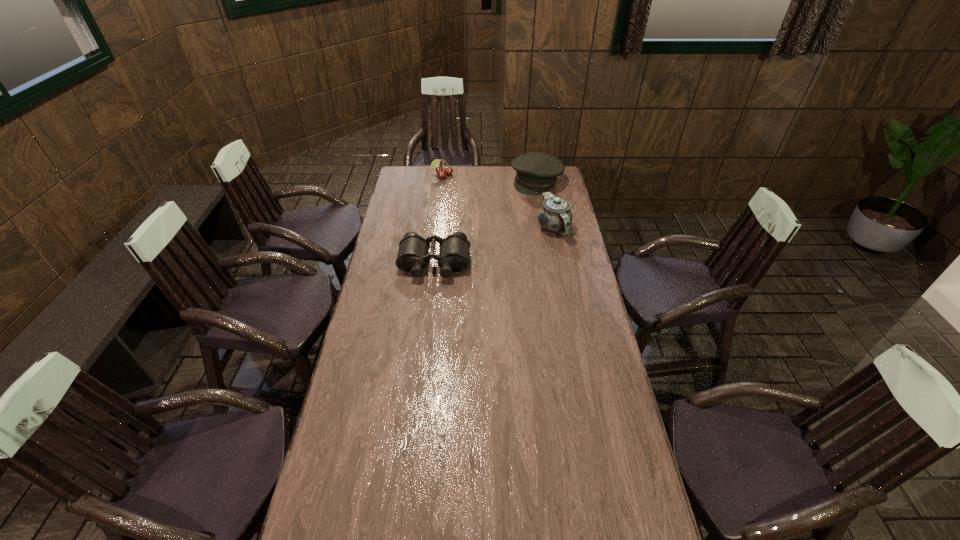
This screenshot has height=540, width=960. Find the location of `vacant space on the desktop that is between the binoculars and the third farthest object and is positioned on the leaves of the cherry`. vacant space on the desktop that is between the binoculars and the third farthest object and is positioned on the leaves of the cherry is located at coordinates (487, 248).

The image size is (960, 540). What are the coordinates of `free spot on the desktop that is between the binoculars and the chinaware and is positioned on the front-facing side of the second tallest object` in the screenshot? It's located at (479, 250).